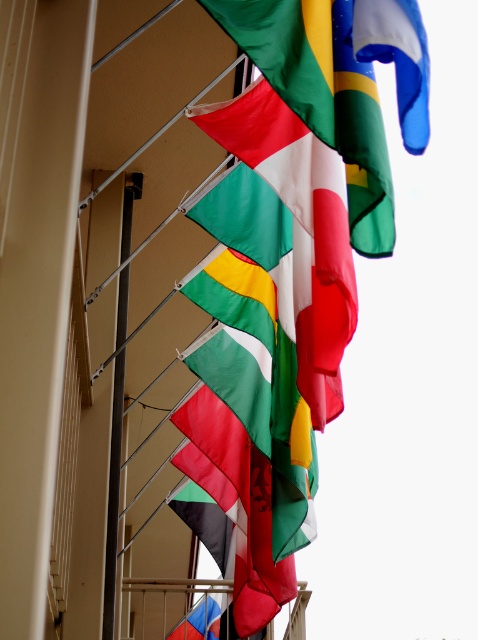
You are a maintenance worker inspecting the flags and poles. You need to determine if the polyester flag at center can be fully displayed without being obstructed by the silver metallic pole at center. Can it be displayed fully?

The polyester flag at center is shorter than the silver metallic pole at center, so the flag will not reach the full length of the pole and may be obstructed at the top by the pole itself.

You are an event organizer setting up a flag display. You have a polyester flag at center and a silver metallic pole at center. Which object is smaller in size?

The polyester flag at center is smaller in size compared to the silver metallic pole at center.

You are a flag installer who needs to ensure that the flags are displayed properly. Given that the textured fabric flag at center and the polyester flag at center are both hanging from the same railing, which flag has a greater width?

The textured fabric flag at center has a greater width than the polyester flag at center, as stated in the description.